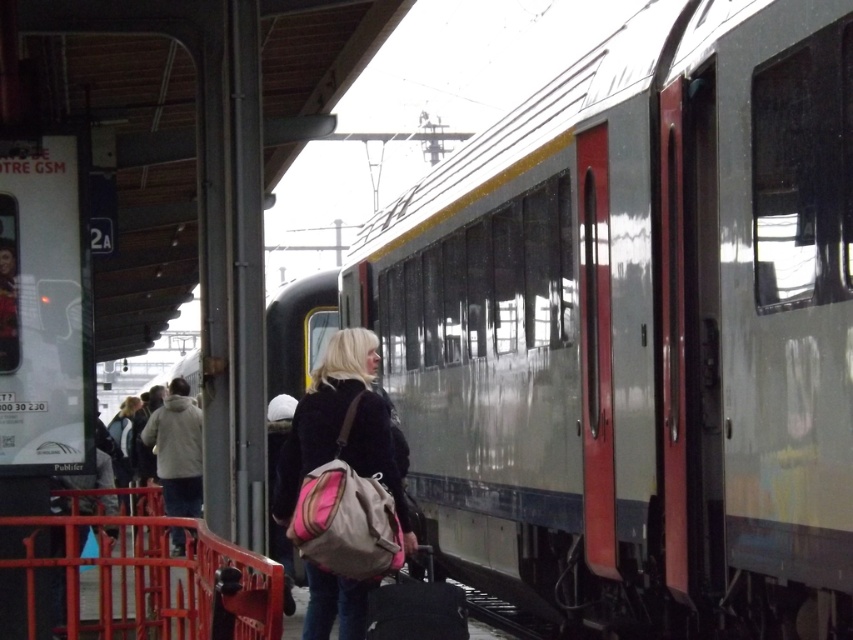
You are a passenger at the train station. You notice the metallic silver train at center and the light gray fleece jacket at left. Which object is taller?

The light gray fleece jacket at left is taller than the metallic silver train at center.

You are standing on the platform and want to board the metallic silver train at center. There is a light gray fleece jacket at left blocking your path. Can you step around it to reach the train?

The metallic silver train at center is closer to the viewer than the light gray fleece jacket at left, so you can step around the light gray fleece jacket at left to reach the metallic silver train at center.